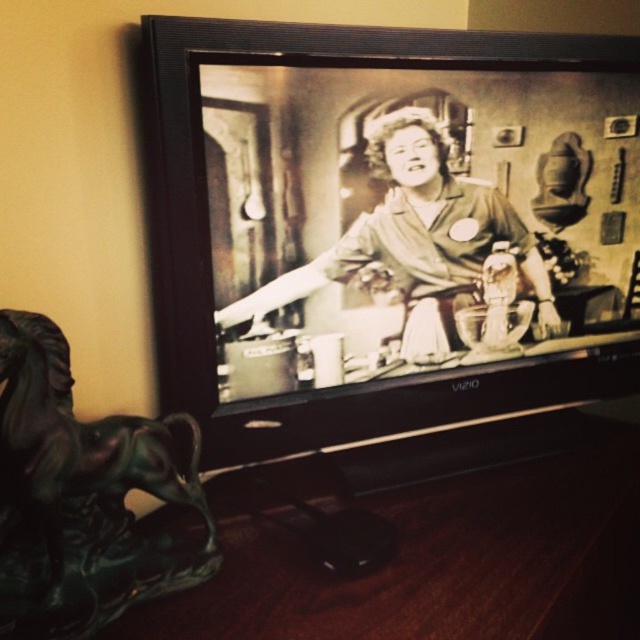
Question: Which point is farther to the camera?

Choices:
 (A) black matte television at center
 (B) matte black dress at center

Answer: (B)

Question: Is black matte television at center thinner than matte black dress at center?

Choices:
 (A) no
 (B) yes

Answer: (A)

Question: Can you confirm if black matte television at center is positioned above matte black dress at center?

Choices:
 (A) yes
 (B) no

Answer: (A)

Question: Is black matte television at center further to the viewer compared to matte black dress at center?

Choices:
 (A) no
 (B) yes

Answer: (A)